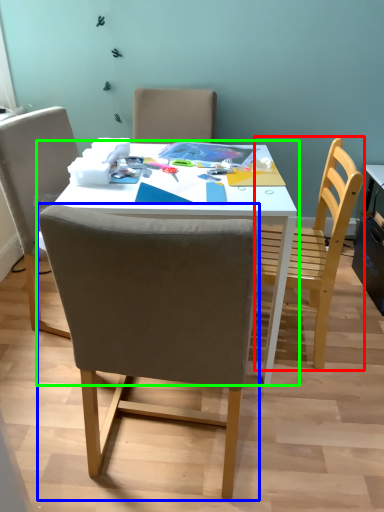
Question: Which object is positioned closest to chair (highlighted by a red box)? Select from chair (highlighted by a blue box) and table (highlighted by a green box).

Choices:
 (A) chair
 (B) table

Answer: (B)